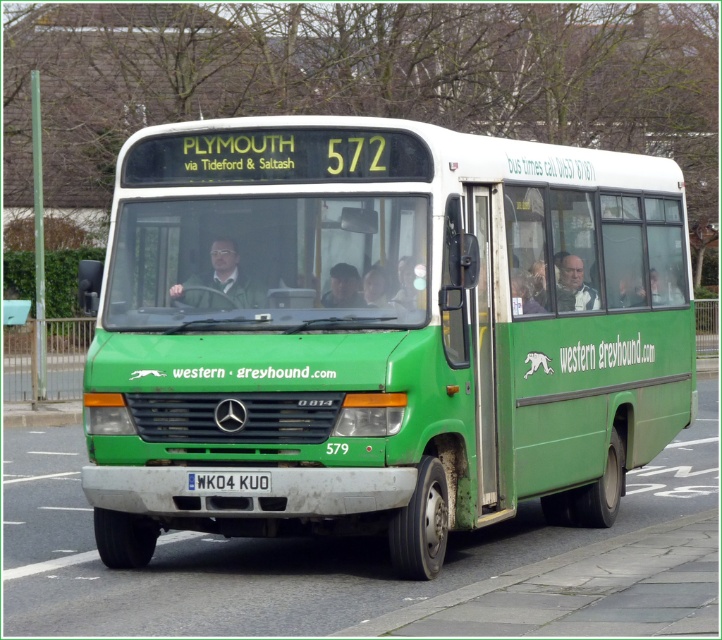
Question: Is white plastic license plate at center to the right of dark brown leather jacket at center from the viewer's perspective?

Choices:
 (A) no
 (B) yes

Answer: (A)

Question: Which object is closer to the camera taking this photo?

Choices:
 (A) white plastic license plate at center
 (B) green matte bus at center

Answer: (B)

Question: Among these objects, which one is farthest from the camera?

Choices:
 (A) green matte jacket at center
 (B) green matte bus at center
 (C) matte black jacket at upper center
 (D) white plastic license plate at center

Answer: (C)

Question: Does white plastic license plate at center have a smaller size compared to dark brown leather jacket at center?

Choices:
 (A) yes
 (B) no

Answer: (A)

Question: Among these objects, which one is nearest to the camera?

Choices:
 (A) green matte jacket at center
 (B) dark brown leather jacket at center

Answer: (B)

Question: Can you confirm if white plastic license plate at center is bigger than dark brown leather jacket at center?

Choices:
 (A) yes
 (B) no

Answer: (B)